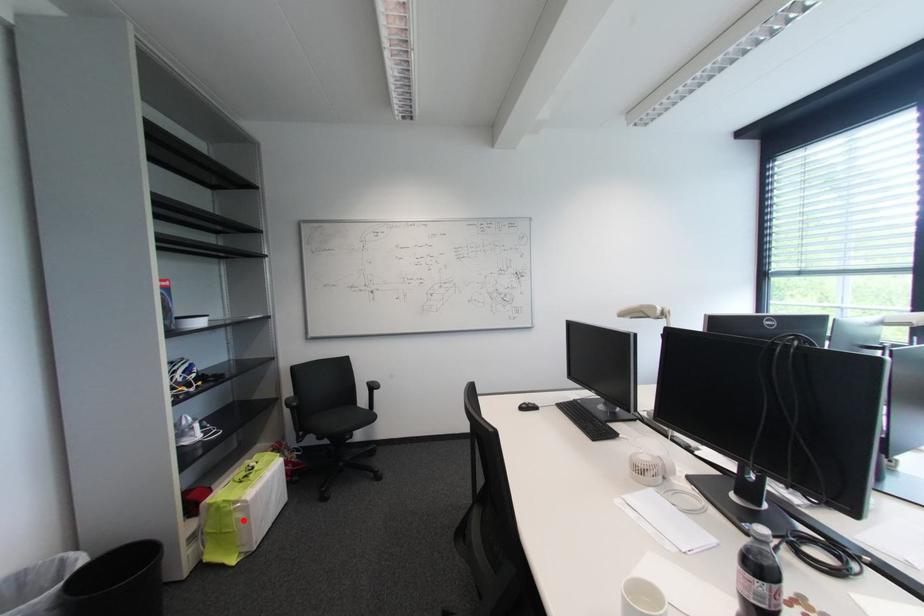
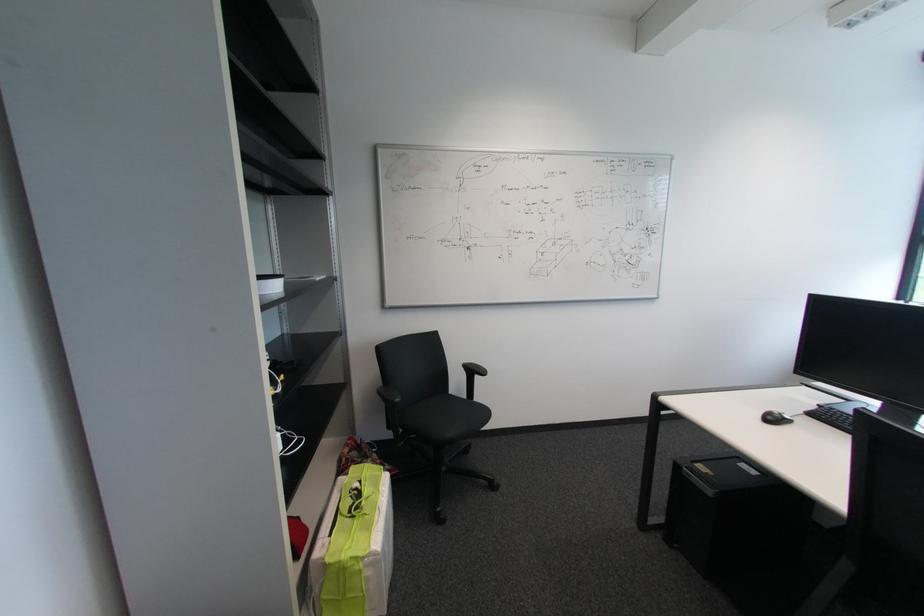
The point at the highlighted location is marked in the first image. Where is the corresponding point in the second image?

(372, 581)